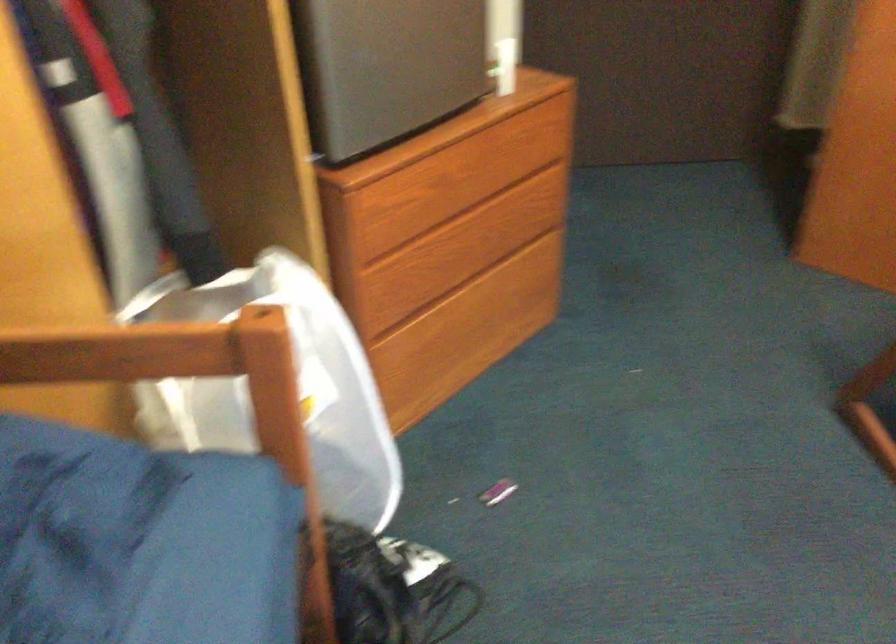
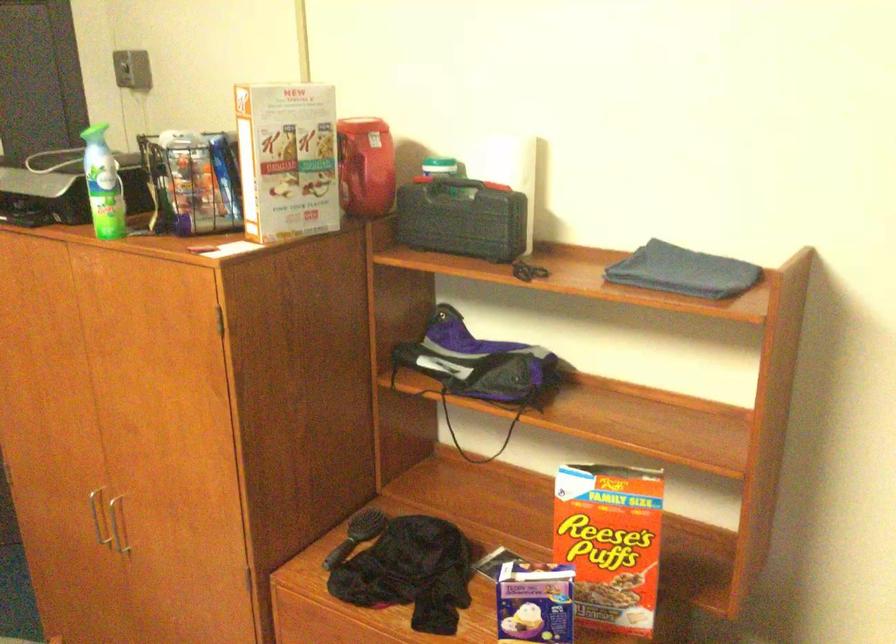
Question: In a continuous first-person perspective shot, in which direction is the camera moving?

Choices:
 (A) Left
 (B) Right
 (C) Forward
 (D) Backward

Answer: (B)